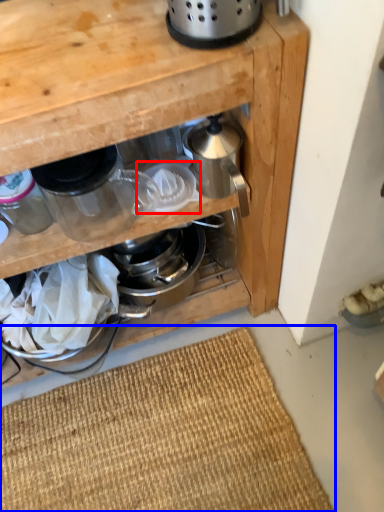
Question: Which point is closer to the camera, appliance (highlighted by a red box) or doormat (highlighted by a blue box)?

Choices:
 (A) appliance
 (B) doormat

Answer: (A)